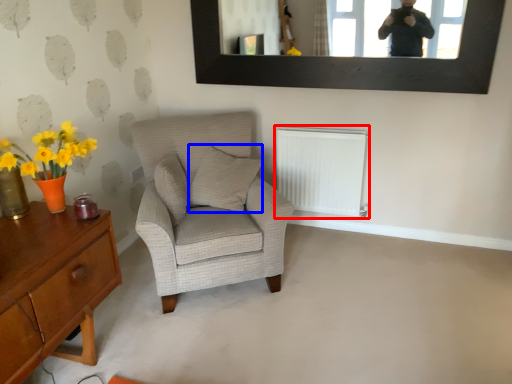
Question: Which object is closer to the camera taking this photo, radiator (highlighted by a red box) or pillow (highlighted by a blue box)?

Choices:
 (A) radiator
 (B) pillow

Answer: (B)